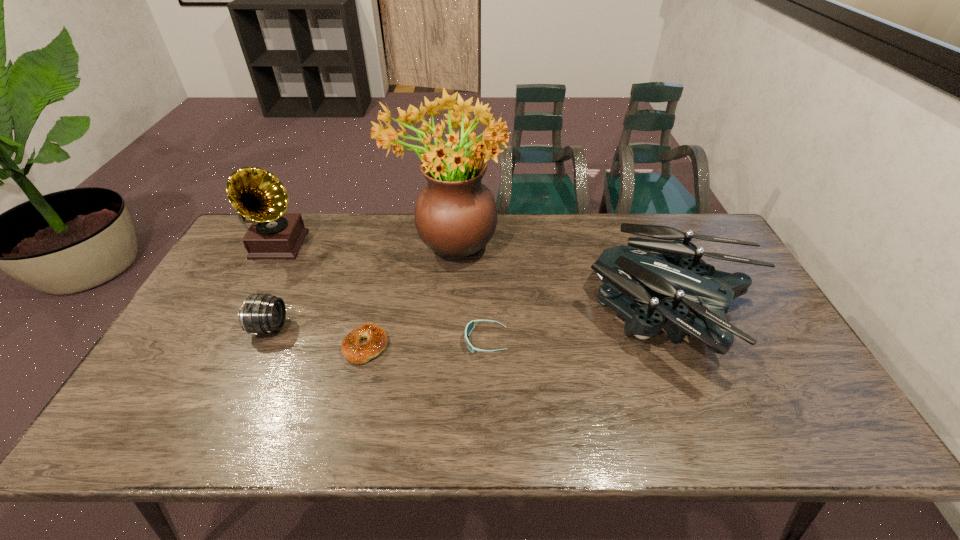
Find the location of a particular element. The height and width of the screenshot is (540, 960). free location that satisfies the following two spatial constraints: 1. on the front side of the fourth shortest object; 2. at the front element of the telephoto lens is located at coordinates (679, 327).

You are a GUI agent. You are given a task and a screenshot of the screen. Output one action in this format:
    pyautogui.click(x=<x>, y=<y>)
    Task: Click on the vacant space that satisfies the following two spatial constraints: 1. from the horn of the tallest object; 2. on the right side of the phonograph record
    Image resolution: width=960 pixels, height=540 pixels.
    Given the screenshot: What is the action you would take?
    pyautogui.click(x=277, y=245)

Where is `vacant space that satisfies the following two spatial constraints: 1. from the horn of the tallest object; 2. on the left side of the second tallest object`? The image size is (960, 540). vacant space that satisfies the following two spatial constraints: 1. from the horn of the tallest object; 2. on the left side of the second tallest object is located at coordinates (277, 245).